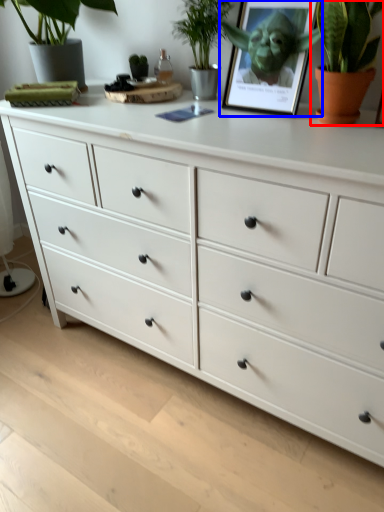
Question: Which of the following is the farthest to the observer, houseplant (highlighted by a red box) or picture frame (highlighted by a blue box)?

Choices:
 (A) houseplant
 (B) picture frame

Answer: (B)